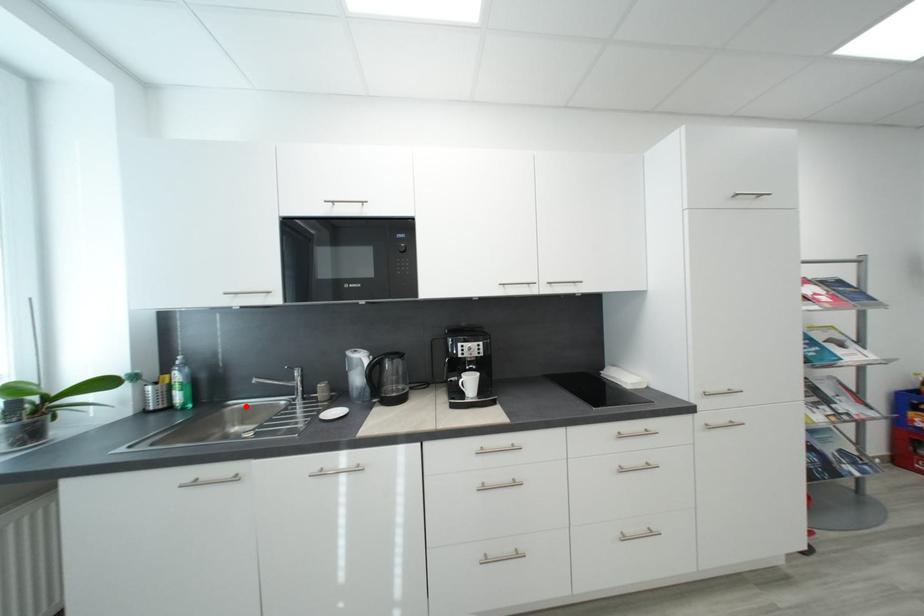
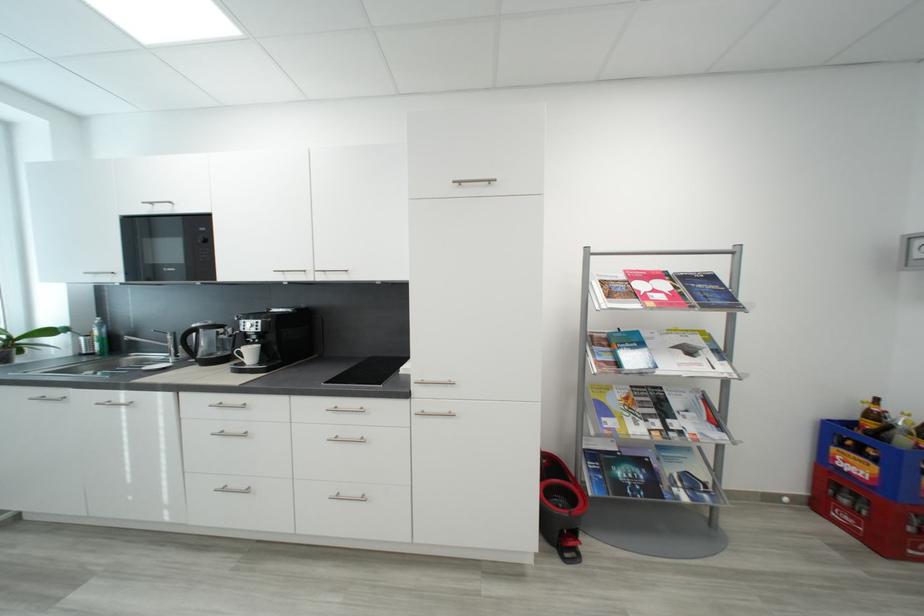
The point at the highlighted location is marked in the first image. Where is the corresponding point in the second image?

(142, 358)